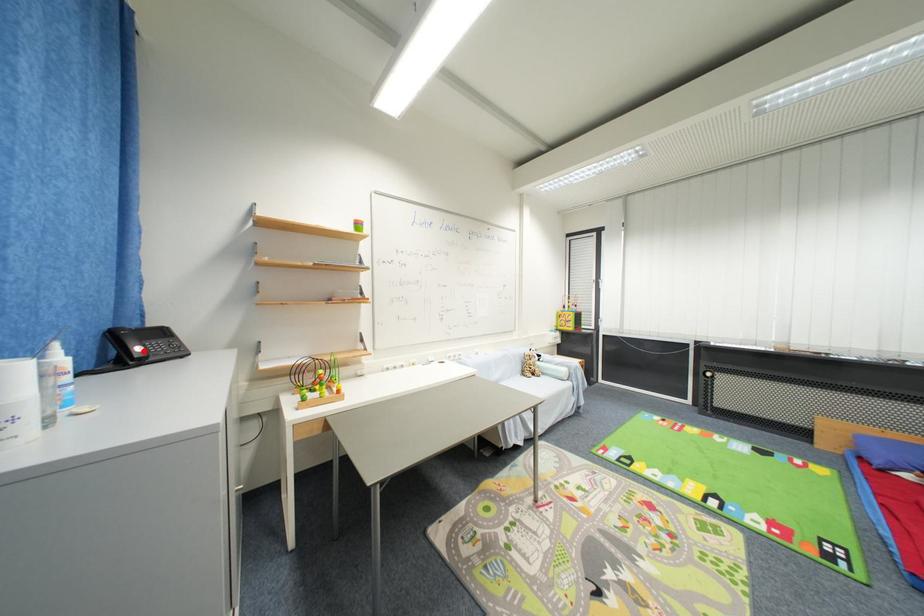
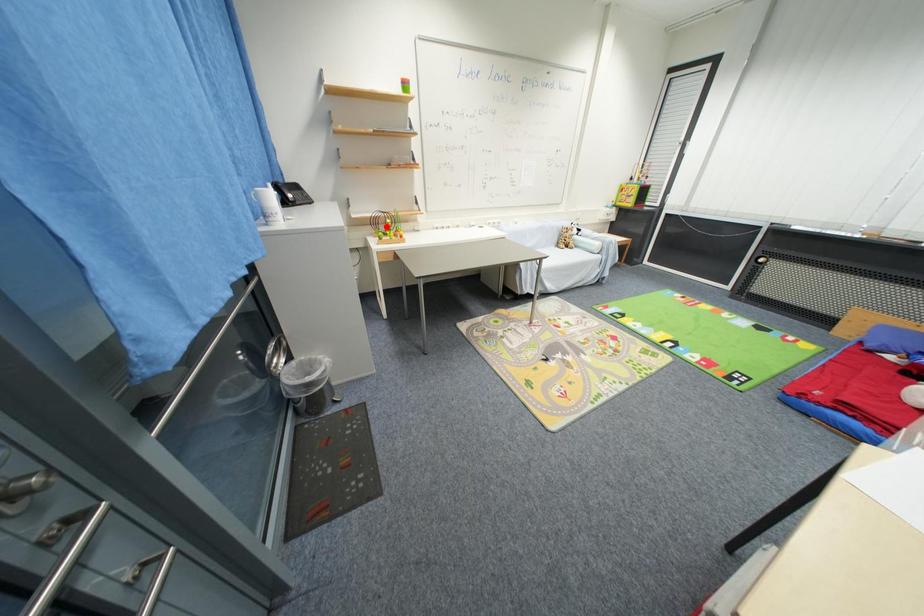
From the picture: I am providing you with two images of the same scene from different viewpoints. A red point is marked on the first image and another point is marked on the second image. Is the red point in image1 aligned with the point shown in image2?

No